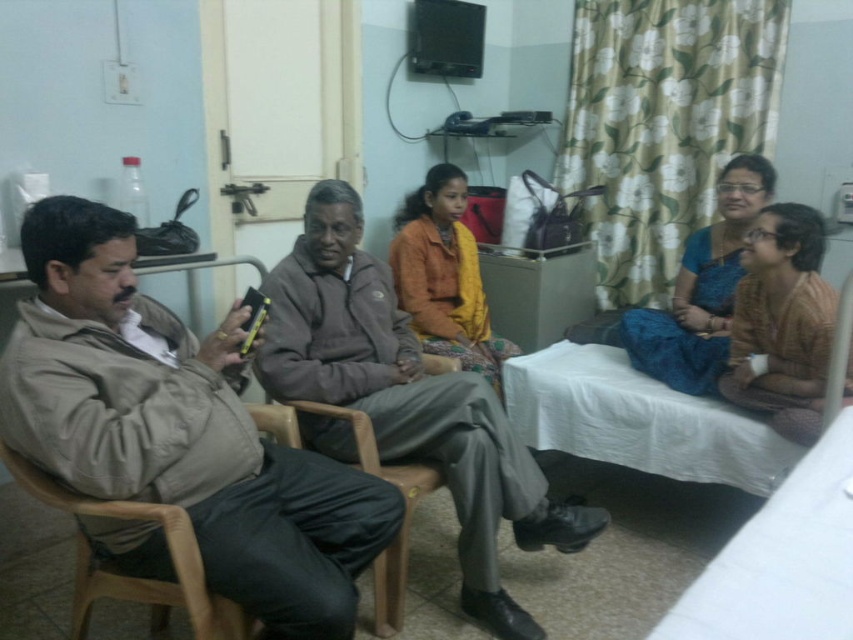
Question: Where is brown textured dress at center located in relation to brown wood chair at left in the image?

Choices:
 (A) right
 (B) left

Answer: (A)

Question: Which point is closer to the camera?

Choices:
 (A) brown wood chair at left
 (B) brown textured dress at center
 (C) blue silk saree at center
 (D) orange fabric jacket at center

Answer: (A)

Question: Which point is closer to the camera?

Choices:
 (A) 483,412
 (B) 77,358
 (C) 387,582
 (D) 41,484

Answer: (D)

Question: Which is farther from the light brown wood chair at left?

Choices:
 (A) orange fabric jacket at center
 (B) brown textured dress at center
 (C) blue silk saree at center

Answer: (C)

Question: Is beige fabric jacket at left to the right of gray fleece jacket at center from the viewer's perspective?

Choices:
 (A) yes
 (B) no

Answer: (B)

Question: Where is brown textured dress at center located in relation to light brown wood chair at left in the image?

Choices:
 (A) right
 (B) left

Answer: (A)